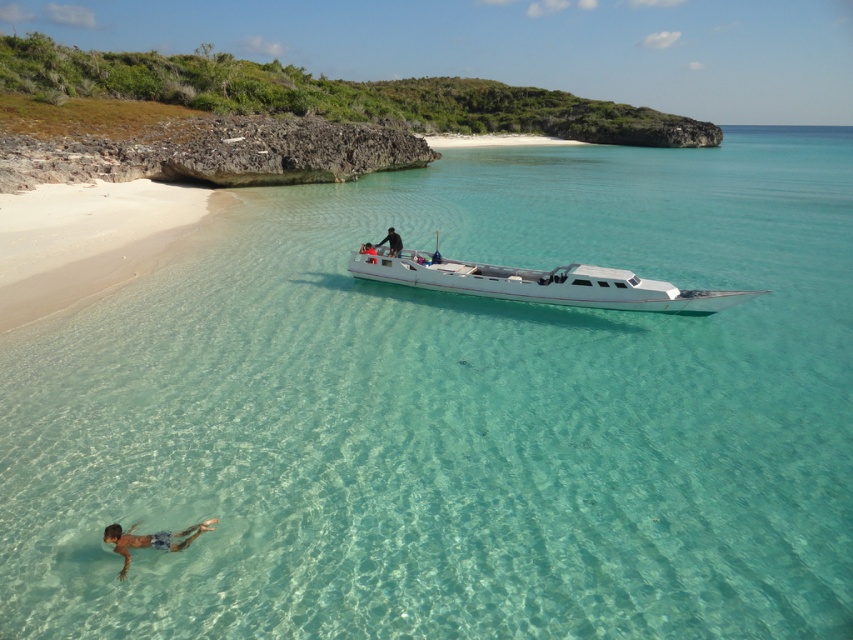
You are a photographer aiming to capture both the white glossy boat at center and the tan skin person at lower left in a single shot. Considering their sizes, which object would appear smaller in the photo?

The white glossy boat at center appears smaller in the photo because it has a lesser height compared to the tan skin person at lower left.

You are a swimmer who wants to reach the white glossy boat at center from the white sand beach at lower left. Which direction should you swim to get there?

The white sand beach at lower left is above the white glossy boat at center, so you should swim downward from the white sand beach at lower left to reach the white glossy boat at center.